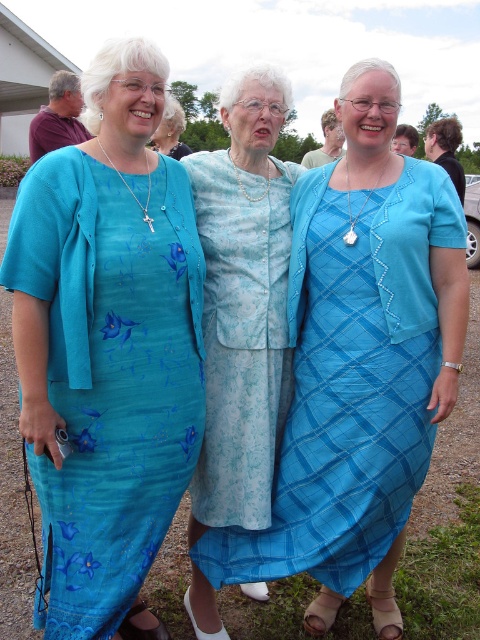
Who is taller, teal floral dress at center or matte blue dress at center?

teal floral dress at center is taller.

Does point (123, 189) come in front of point (323, 234)?

Yes.

This screenshot has width=480, height=640. What are the coordinates of `teal floral dress at center` in the screenshot? It's located at (110, 374).

Does teal floral dress at center appear on the left side of light blue floral dress at center?

Correct, you'll find teal floral dress at center to the left of light blue floral dress at center.

Which is in front, point (163, 396) or point (214, 627)?

Point (163, 396) is more forward.

Does point (47, 579) lie behind point (230, 118)?

No, (47, 579) is closer to viewer.

Locate an element on the screen. teal floral dress at center is located at coordinates (110, 374).

Is matte blue dress at center below light blue floral dress at center?

Yes.

Which is more to the right, matte blue dress at center or light blue floral dress at center?

From the viewer's perspective, matte blue dress at center appears more on the right side.

Image resolution: width=480 pixels, height=640 pixels. Describe the element at coordinates (350, 381) in the screenshot. I see `matte blue dress at center` at that location.

This screenshot has width=480, height=640. What are the coordinates of `matte blue dress at center` in the screenshot? It's located at (350, 381).